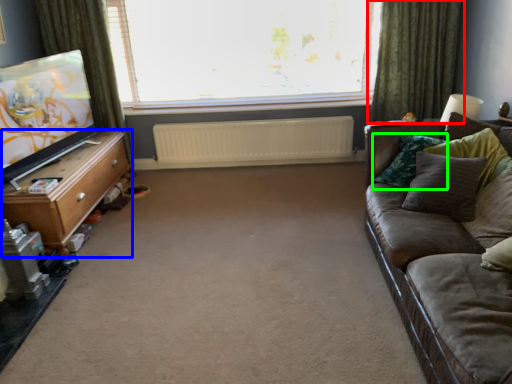
Question: Estimate the real-world distances between objects in this image. Which object is farther from curtain (highlighted by a red box), table (highlighted by a blue box) or pillow (highlighted by a green box)?

Choices:
 (A) table
 (B) pillow

Answer: (A)